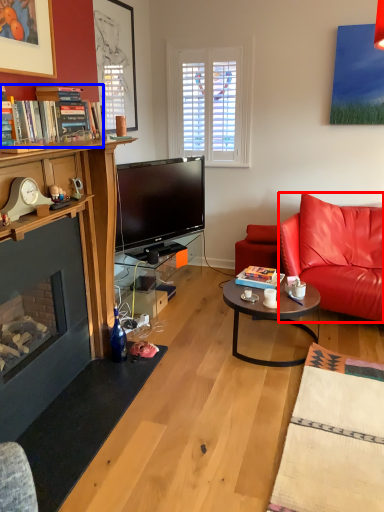
Question: Which object is closer to the camera taking this photo, cushion (highlighted by a red box) or book (highlighted by a blue box)?

Choices:
 (A) cushion
 (B) book

Answer: (B)